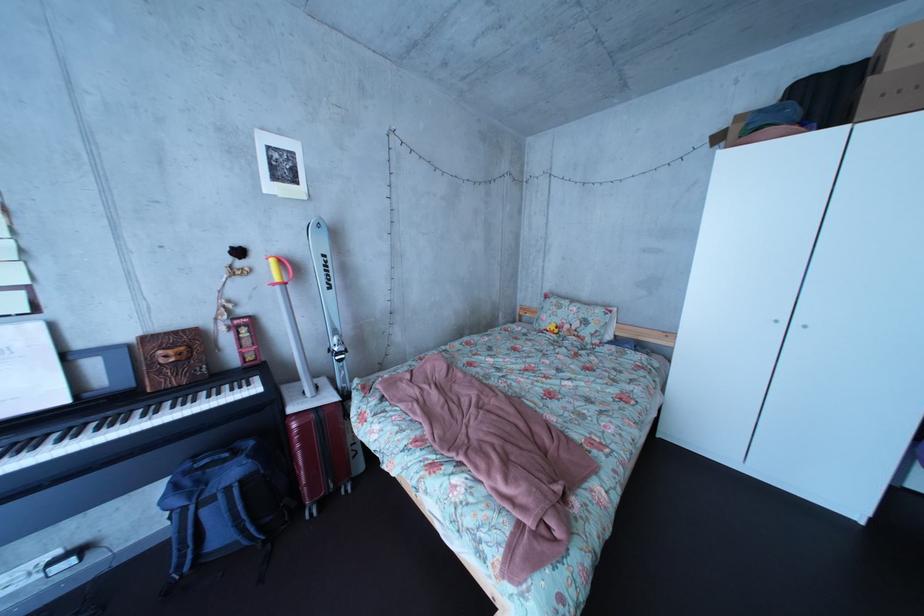
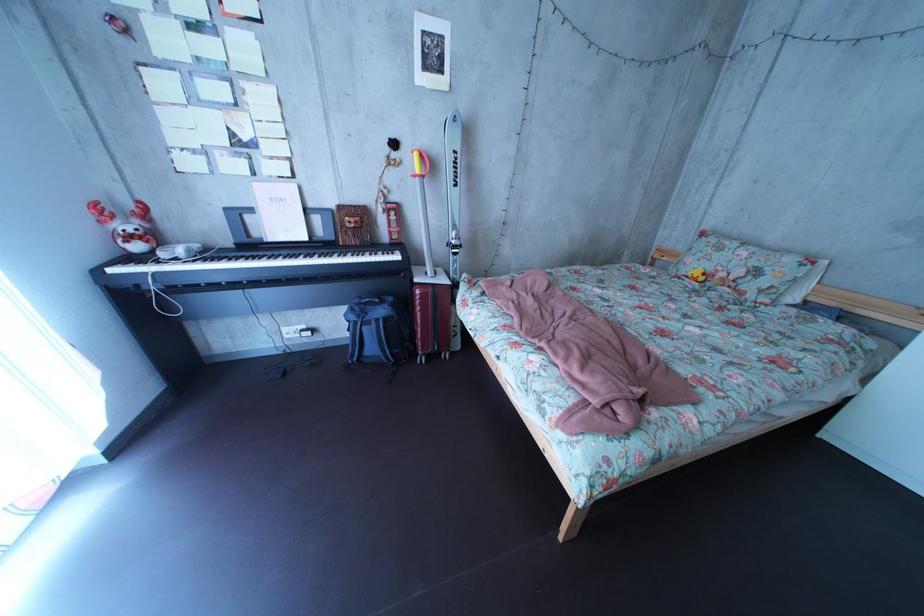
Where in the second image is the point corresponding to the point at 573,320 from the first image?

(731, 262)